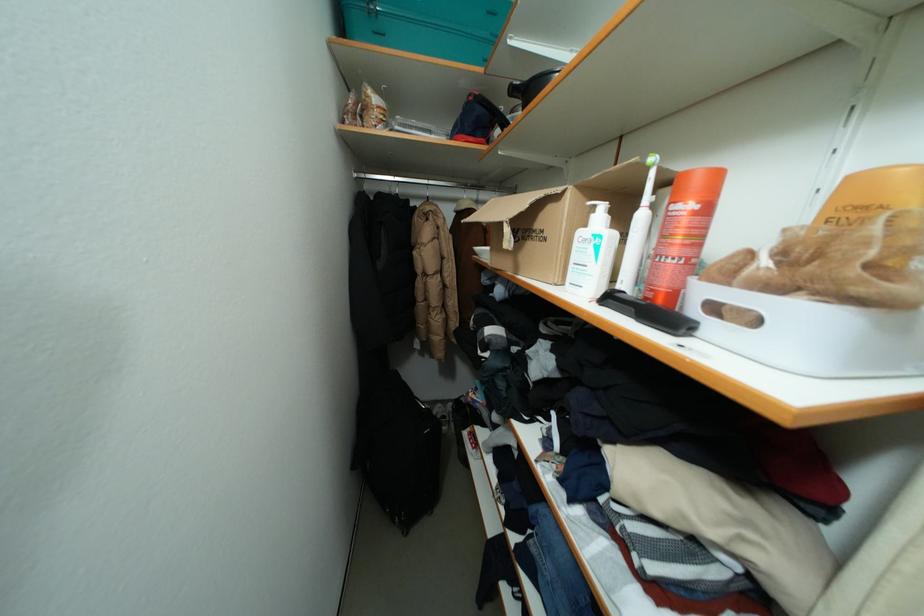
You are a GUI agent. You are given a task and a screenshot of the screen. Output one action in this format:
    pyautogui.click(x=<x>, y=<y>)
    Task: Click on the black electric trimmer
    This screenshot has height=616, width=924.
    Given the screenshot: What is the action you would take?
    pyautogui.click(x=649, y=313)